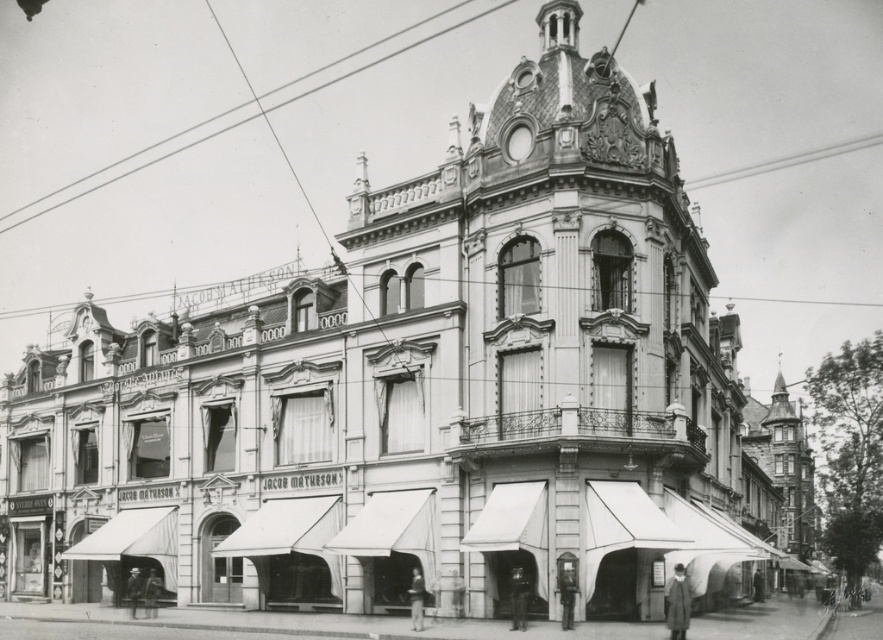
You are standing in front of the grand building and want to determine the relative positions of two points marked on the facade. Which point is closer to you, the point at coordinates (331, 532) or the point at (131, 509)?

The point at coordinates (331, 532) is closer to the viewer than the point at (131, 509).

You are a window cleaner standing at the entrance of the building. You need to clean both the white fabric canopy at lower center and the white fabric canopy at lower left. Which canopy will require you to use a ladder to reach its top edge?

The white fabric canopy at lower left will require a ladder because it is taller than the white fabric canopy at lower center.